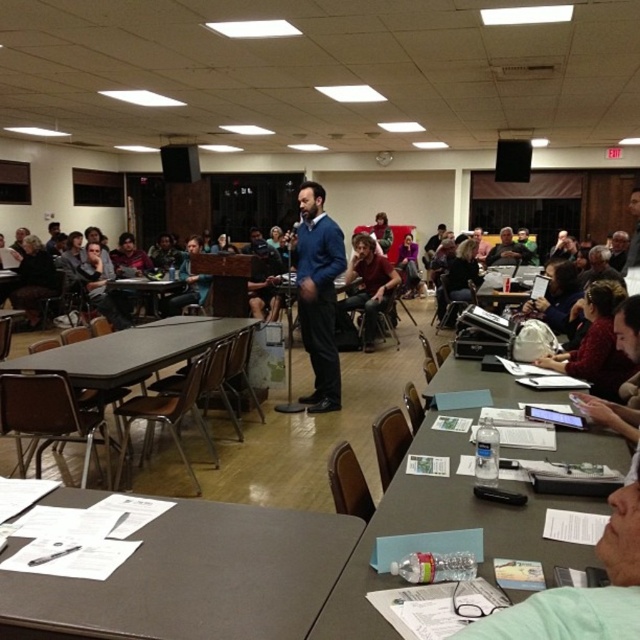
Does clear plastic water bottle at lower right have a lesser width compared to matte black jacket at upper center?

Incorrect, clear plastic water bottle at lower right's width is not less than matte black jacket at upper center's.

Between point (333, 588) and point (486, 259), which one is positioned behind?

The point (486, 259) is behind.

Does point (449, 365) lie behind point (529, 250)?

That is False.

In order to click on clear plastic water bottle at lower right in this screenshot , I will do `click(442, 529)`.

Which is above, matte gray table at lower left or matte black table at left?

matte black table at left

Which is behind, point (184, 545) or point (6, 285)?

The point (6, 285) is behind.

Identify the location of matte gray table at lower left. The image size is (640, 640). (195, 579).

Does point (172, 289) lie behind point (4, 291)?

No, it is in front of (4, 291).

Which of these two, metallic silver table at center or matte black table at left, stands shorter?

metallic silver table at center is shorter.

Who is more forward, [172,280] or [4,285]?

Positioned in front is point [172,280].

Where is `metallic silver table at center`? This screenshot has height=640, width=640. metallic silver table at center is located at coordinates (145, 285).